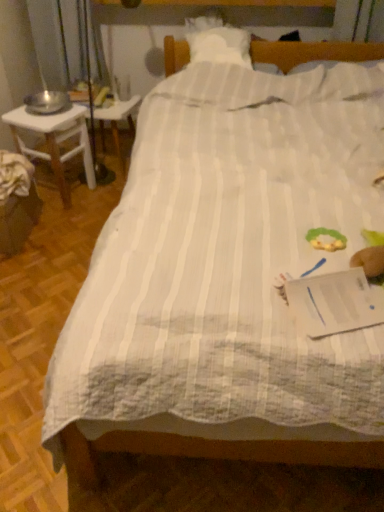
Describe the element at coordinates (55, 141) in the screenshot. The height and width of the screenshot is (512, 384). I see `white wooden desk at left` at that location.

Identify the location of white wooden desk at left. (55, 141).

Describe the element at coordinates (117, 123) in the screenshot. The width and height of the screenshot is (384, 512). I see `white plastic table at left` at that location.

Where is `white plastic table at left`? This screenshot has height=512, width=384. white plastic table at left is located at coordinates (117, 123).

What are the coordinates of `white wooden desk at left` in the screenshot? It's located at [55, 141].

Which object is positioned more to the left, white wooden desk at left or white plastic table at left?

From the viewer's perspective, white wooden desk at left appears more on the left side.

Between white wooden desk at left and white plastic table at left, which one is positioned in front?

white wooden desk at left is closer to the camera.

Which is less distant, (22, 141) or (104, 149)?

Point (22, 141) appears to be closer to the viewer than point (104, 149).

From the image's perspective, is white wooden desk at left over white plastic table at left?

Actually, white wooden desk at left appears below white plastic table at left in the image.

From a real-world perspective, is white wooden desk at left located higher than white plastic table at left?

Yes, from a real-world perspective, white wooden desk at left is on top of white plastic table at left.

Looking at their sizes, would you say white wooden desk at left is wider or thinner than white plastic table at left?

Considering their sizes, white wooden desk at left looks broader than white plastic table at left.

From the picture: Considering the sizes of white wooden desk at left and white plastic table at left in the image, is white wooden desk at left taller or shorter than white plastic table at left?

Clearly, white wooden desk at left is taller compared to white plastic table at left.

In the scene shown: Between white wooden desk at left and white plastic table at left, which one has smaller size?

With smaller size is white plastic table at left.

Is white plastic table at left located within white wooden desk at left?

No, white plastic table at left is not surrounded by white wooden desk at left.

Would you say white wooden desk at left is a long distance from white plastic table at left?

No, white wooden desk at left is in close proximity to white plastic table at left.

Is white wooden desk at left looking in the opposite direction of white plastic table at left?

No.

What's the angular difference between white wooden desk at left and white plastic table at left's facing directions?

12.9 degrees separate the facing orientations of white wooden desk at left and white plastic table at left.

Where is `desk lying below the white plastic table at left (from the image's perspective)`? The width and height of the screenshot is (384, 512). desk lying below the white plastic table at left (from the image's perspective) is located at coordinates (55, 141).

Considering the relative positions of white plastic table at left and white wooden desk at left in the image provided, is white plastic table at left to the right of white wooden desk at left from the viewer's perspective?

Yes.

Who is more distant, white plastic table at left or white wooden desk at left?

white plastic table at left.

Does point (138, 98) appear closer or farther from the camera than point (78, 150)?

Clearly, point (138, 98) is more distant from the camera than point (78, 150).

From the image's perspective, between white plastic table at left and white wooden desk at left, which one is located above?

white plastic table at left, from the image's perspective.

From a real-world perspective, between white plastic table at left and white wooden desk at left, who is vertically lower?

In real-world perspective, white plastic table at left is lower.

Consider the image. Which object is thinner, white plastic table at left or white wooden desk at left?

white plastic table at left is thinner.

Considering the relative sizes of white plastic table at left and white wooden desk at left in the image provided, is white plastic table at left shorter than white wooden desk at left?

Indeed, white plastic table at left has a lesser height compared to white wooden desk at left.

Looking at the image, does white plastic table at left seem bigger or smaller compared to white wooden desk at left?

Clearly, white plastic table at left is smaller in size than white wooden desk at left.

Would you say white plastic table at left is outside white wooden desk at left?

white plastic table at left is positioned outside white wooden desk at left.

Is white plastic table at left touching white wooden desk at left?

They are not placed beside each other.

Is white plastic table at left facing towards white wooden desk at left?

No, white plastic table at left is not turned towards white wooden desk at left.

This screenshot has height=512, width=384. I want to click on desk on the left of white plastic table at left, so click(55, 141).

This screenshot has width=384, height=512. I want to click on desk on the left of the white plastic table at left, so click(x=55, y=141).

I want to click on desk in front of the white plastic table at left, so click(55, 141).